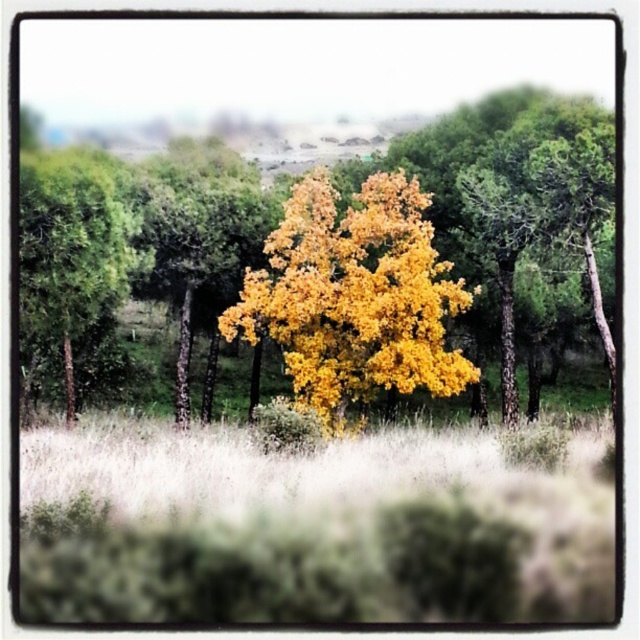
Question: Considering the real-world distances, which object is farthest from the golden yellow leaves at center?

Choices:
 (A) yellow leafy tree at center
 (B) green matte tree at left

Answer: (B)

Question: Considering the real-world distances, which object is closest to the yellow leafy tree at center?

Choices:
 (A) yellow-green grass at center
 (B) green matte tree at left
 (C) golden yellow leaves at center

Answer: (C)

Question: Is yellow-green grass at center smaller than yellow leafy tree at center?

Choices:
 (A) yes
 (B) no

Answer: (A)

Question: Is yellow-green grass at center bigger than golden yellow leaves at center?

Choices:
 (A) no
 (B) yes

Answer: (A)

Question: Does yellow leafy tree at center have a smaller size compared to green matte tree at left?

Choices:
 (A) no
 (B) yes

Answer: (A)

Question: Which object appears closest to the camera in this image?

Choices:
 (A) yellow-green grass at center
 (B) yellow leafy tree at center

Answer: (A)